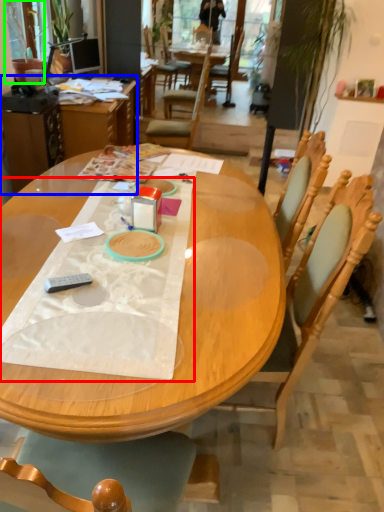
Question: Which object is the farthest from sheet (highlighted by a red box)? Choose among these: table (highlighted by a blue box) or houseplant (highlighted by a green box).

Choices:
 (A) table
 (B) houseplant

Answer: (B)